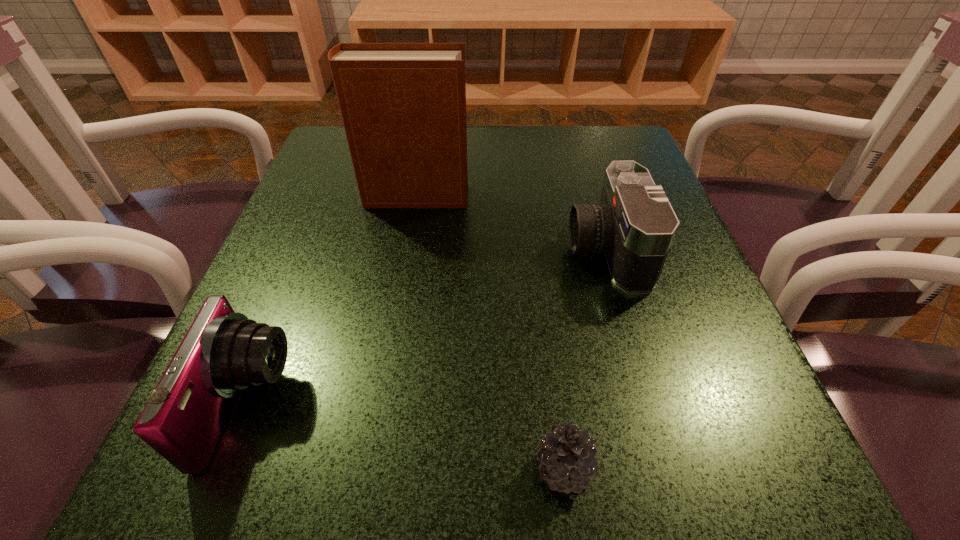
This screenshot has height=540, width=960. In order to click on vacant space that satisfies the following two spatial constraints: 1. on the back side of the second object from right to left; 2. on the front-facing side of the nearer camera in this screenshot , I will do `click(555, 404)`.

The image size is (960, 540). Find the location of `free space that satisfies the following two spatial constraints: 1. on the front-facing side of the leftmost object; 2. on the right side of the pinecone`. free space that satisfies the following two spatial constraints: 1. on the front-facing side of the leftmost object; 2. on the right side of the pinecone is located at coordinates click(223, 470).

Where is `vacant position in the image that satisfies the following two spatial constraints: 1. on the open cover of the shortest object; 2. on the left side of the second object from left to right`? The height and width of the screenshot is (540, 960). vacant position in the image that satisfies the following two spatial constraints: 1. on the open cover of the shortest object; 2. on the left side of the second object from left to right is located at coordinates (368, 470).

Identify the location of vacant space that satisfies the following two spatial constraints: 1. on the front-facing side of the leftmost object; 2. on the left side of the shortest object. The height and width of the screenshot is (540, 960). (223, 470).